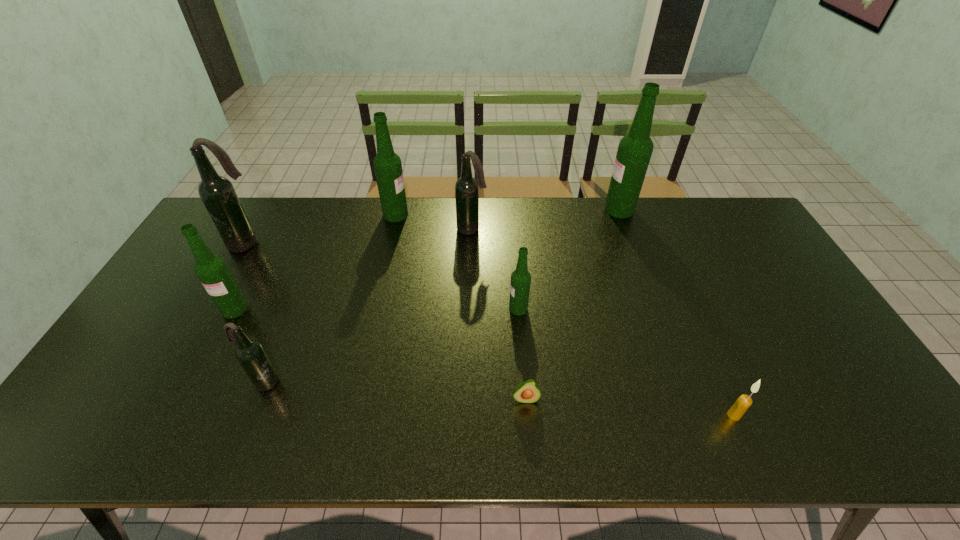
Locate an element on the screen. The image size is (960, 540). free space located on the right of the biggest dark beer bottle is located at coordinates (304, 243).

Where is `vacant space located 0.070m on the back of the fifth beer bottle from left to right`? vacant space located 0.070m on the back of the fifth beer bottle from left to right is located at coordinates (472, 211).

The height and width of the screenshot is (540, 960). I want to click on vacant region located 0.050m on the label of the leftmost green beer bottle, so click(x=222, y=333).

The height and width of the screenshot is (540, 960). I want to click on vacant space situated on the label of the smallest green beer bottle, so click(477, 308).

Find the location of a particular element. The width and height of the screenshot is (960, 540). vacant space located 0.240m on the label of the smallest green beer bottle is located at coordinates (425, 308).

Image resolution: width=960 pixels, height=540 pixels. I want to click on blank space located 0.070m on the label of the smallest green beer bottle, so click(x=485, y=308).

This screenshot has height=540, width=960. What are the coordinates of `vacant space situated on the back of the smallest dark beer bottle` in the screenshot? It's located at (281, 338).

You are a GUI agent. You are given a task and a screenshot of the screen. Output one action in this format:
    pyautogui.click(x=<x>, y=<y>)
    Task: Click on the free location located 0.090m on the right of the eighth tallest object
    
    Given the screenshot: What is the action you would take?
    pyautogui.click(x=779, y=415)

Find the location of a particular element. blank space located 0.100m on the cut side of the green avocado is located at coordinates (530, 448).

Find the location of a particular element. The width and height of the screenshot is (960, 540). object positioned at the near edge is located at coordinates (744, 401).